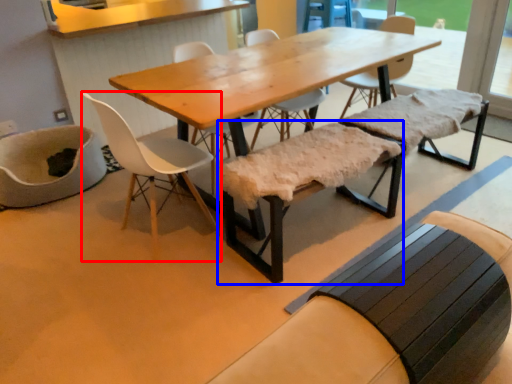
Question: Which point is closer to the camera, chair (highlighted by a red box) or church bench (highlighted by a blue box)?

Choices:
 (A) chair
 (B) church bench

Answer: (A)